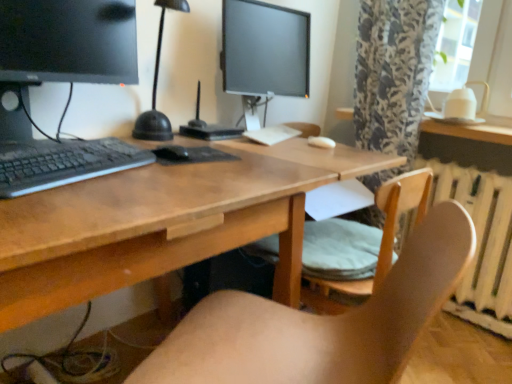
Locate an element on the screen. free space in front of black matte mouse at center is located at coordinates (167, 171).